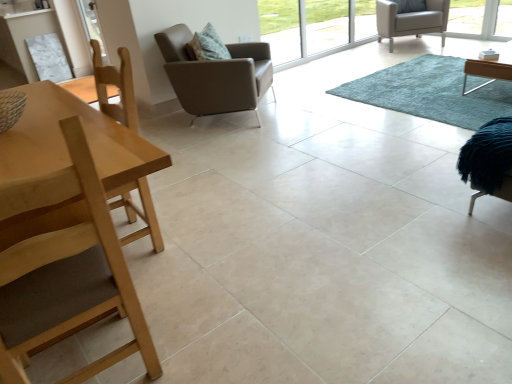
Question: Is blue shaggy rug at center smaller than leather-like brown armchair at center, the second chair when ordered from right to left?

Choices:
 (A) no
 (B) yes

Answer: (B)

Question: Is blue shaggy rug at center taller than leather-like brown armchair at center, the 2th chair from the front?

Choices:
 (A) no
 (B) yes

Answer: (A)

Question: Is blue shaggy rug at center turned away from leather-like brown armchair at center, the 2th chair from the bottom?

Choices:
 (A) no
 (B) yes

Answer: (A)

Question: Is blue shaggy rug at center facing towards leather-like brown armchair at center, which ranks as the 2th chair in back-to-front order?

Choices:
 (A) no
 (B) yes

Answer: (A)

Question: Is blue shaggy rug at center closer to camera compared to leather-like brown armchair at center, the second chair in the top-to-bottom sequence?

Choices:
 (A) yes
 (B) no

Answer: (A)

Question: Is transparent glass window at upper center inside the boundaries of light wood chair at left, positioned as the 3th chair in right-to-left order, or outside?

Choices:
 (A) inside
 (B) outside

Answer: (B)

Question: Is point (330, 49) closer or farther from the camera than point (100, 284)?

Choices:
 (A) closer
 (B) farther

Answer: (B)

Question: From a real-world perspective, is transparent glass window at upper center physically located above or below light wood chair at left, arranged as the first chair when viewed from the left?

Choices:
 (A) above
 (B) below

Answer: (B)

Question: From the image's perspective, is transparent glass window at upper center above or below light wood chair at left, which ranks as the first chair in front-to-back order?

Choices:
 (A) above
 (B) below

Answer: (A)

Question: Based on their sizes in the image, would you say leather-like brown armchair at center, acting as the 2th chair starting from the left, is bigger or smaller than light brown leather armchair at upper right, which appears as the 1th chair when viewed from the right?

Choices:
 (A) small
 (B) big

Answer: (B)

Question: Does point (183, 86) appear closer or farther from the camera than point (386, 14)?

Choices:
 (A) farther
 (B) closer

Answer: (B)

Question: Considering the positions of leather-like brown armchair at center, the second chair when ordered from right to left, and light brown leather armchair at upper right, placed as the first chair when sorted from back to front, in the image, is leather-like brown armchair at center, the second chair when ordered from right to left, taller or shorter than light brown leather armchair at upper right, placed as the first chair when sorted from back to front,?

Choices:
 (A) tall
 (B) short

Answer: (A)

Question: Would you say leather-like brown armchair at center, which ranks as the 2th chair in back-to-front order, is to the left or to the right of light brown leather armchair at upper right, the 1th chair when ordered from top to bottom, in the picture?

Choices:
 (A) left
 (B) right

Answer: (A)

Question: From a real-world perspective, is leather-like brown armchair at center, the 2th chair from the bottom, positioned above or below light wood table at left?

Choices:
 (A) above
 (B) below

Answer: (B)

Question: Relative to light wood table at left, is leather-like brown armchair at center, acting as the 2th chair starting from the left, in front or behind?

Choices:
 (A) behind
 (B) front

Answer: (A)